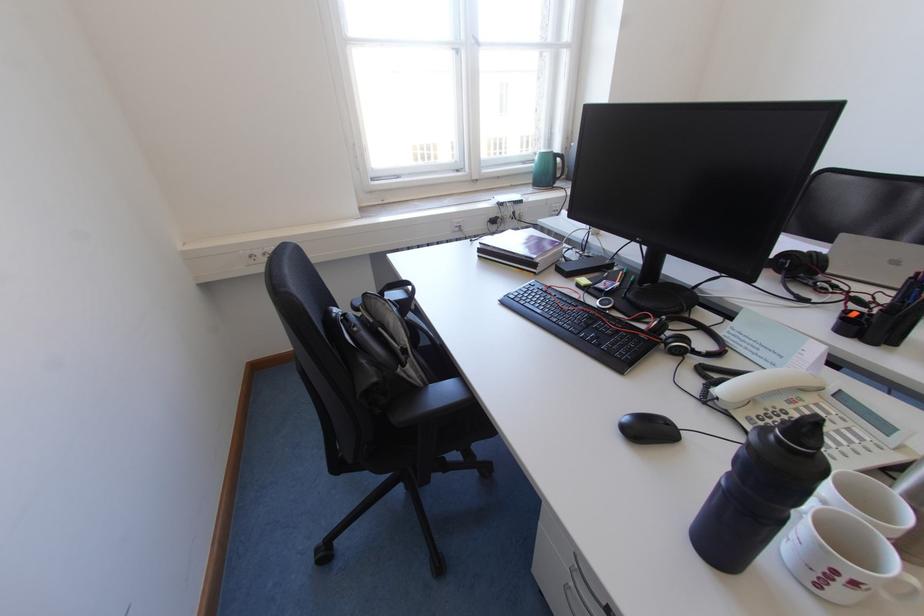
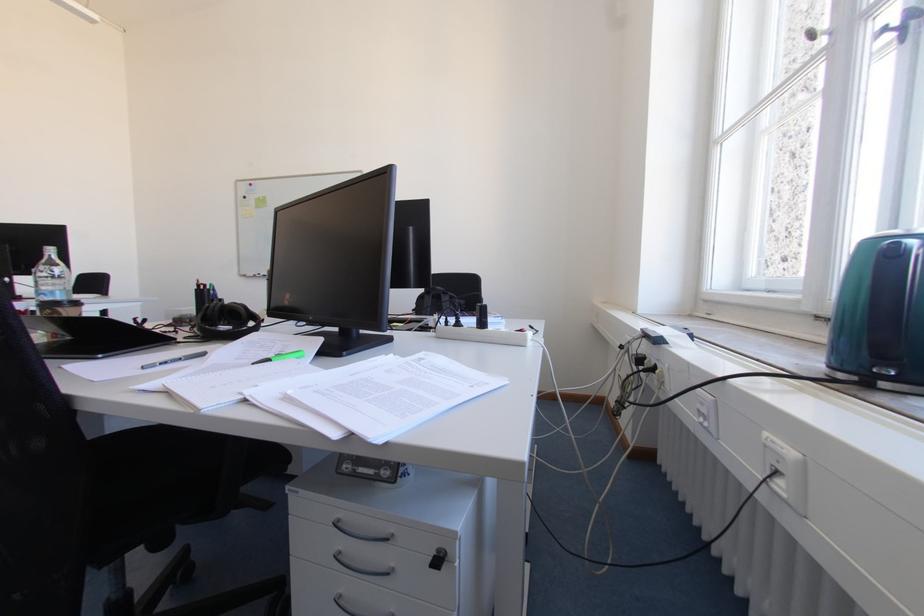
Question: I am providing you with two images of the same scene from different viewpoints. Please identify which objects are invisible in image2.

Choices:
 (A) white mug handle
 (B) closed black laptop
 (C) grey remote control
 (D) green capped pen

Answer: (A)